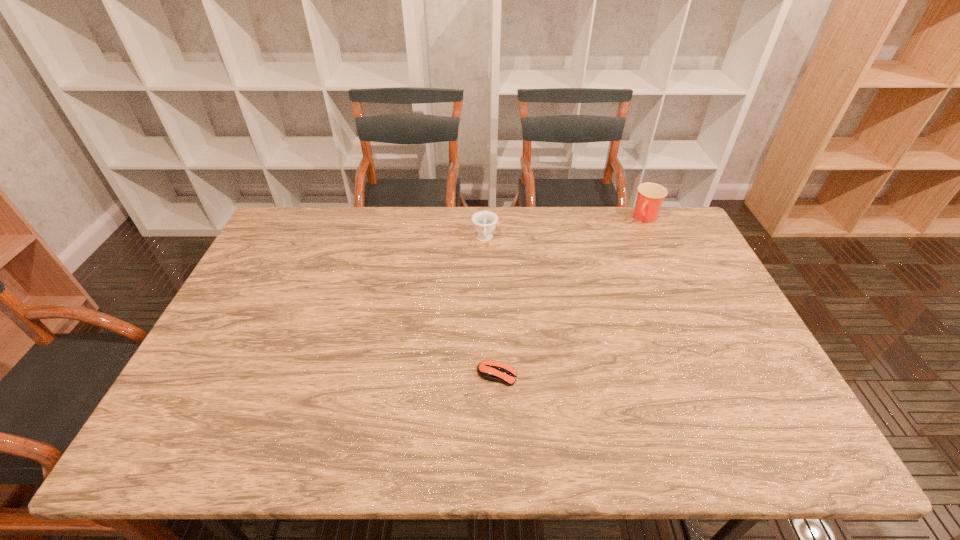
This screenshot has width=960, height=540. What are the coordinates of `the rightmost object` in the screenshot? It's located at (650, 196).

This screenshot has height=540, width=960. In order to click on the farthest object in this screenshot , I will do `click(650, 196)`.

Image resolution: width=960 pixels, height=540 pixels. I want to click on the second tallest object, so click(484, 222).

The image size is (960, 540). In order to click on the second farthest object in this screenshot , I will do `click(484, 222)`.

Image resolution: width=960 pixels, height=540 pixels. In order to click on the nearest object in this screenshot , I will do point(490,370).

Find the location of a particular element. The height and width of the screenshot is (540, 960). computer mouse is located at coordinates (490, 370).

Where is `vacant space located on the front of the tallest object`? This screenshot has height=540, width=960. vacant space located on the front of the tallest object is located at coordinates (678, 286).

Locate an element on the screen. The image size is (960, 540). vacant space located 0.370m on the side of the second nearest object with the handle is located at coordinates (486, 338).

Image resolution: width=960 pixels, height=540 pixels. What are the coordinates of `free region located 0.270m on the back of the shortest object` in the screenshot? It's located at (494, 289).

At what (x,y) coordinates should I click in order to perform the action: click on cup situated at the far edge. Please return your answer as a coordinate pair (x, y). Looking at the image, I should click on (650, 196).